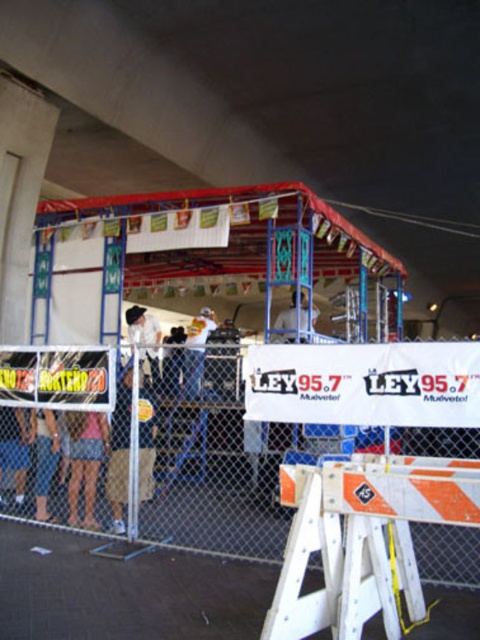
You are at an outdoor event under a large overpass structure. You see a point marked at coordinates (362, 538). According to the scene description, where exactly is this point located?

The point at coordinates (362, 538) is on the white plastic barricade at lower center.

You are at the event and want to take a photo of the stage. The white plastic barricade at lower center is in your way. If you move 0.1 units to the right, will you still be able to see the stage?

Moving 0.1 units to the right from the white plastic barricade at lower center at point (362, 538) would place you at position (362, 602). Since the barricade is at the lower center, moving right might still allow visibility of the stage depending on the barricade length. However, without knowing the barricade length, it is uncertain. The answer can not be determined with given information.